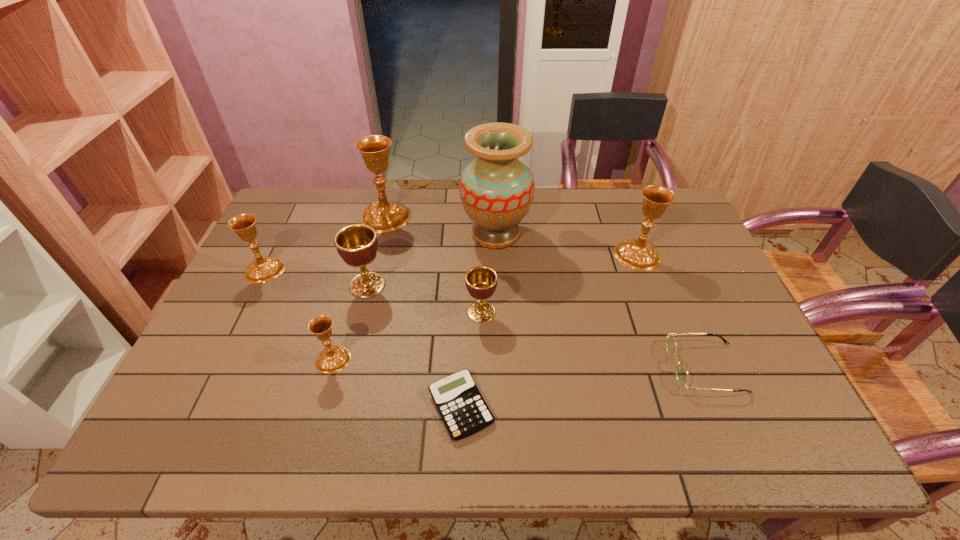
Identify the location of gold chalice that is the fourth closest one to the tallest object. Image resolution: width=960 pixels, height=540 pixels. (262, 269).

The width and height of the screenshot is (960, 540). I want to click on blank area in the image that satisfies the following two spatial constraints: 1. on the front side of the nearest gold chalice; 2. on the left side of the leftmost chalice, so click(x=221, y=359).

Where is `free region that satisfies the following two spatial constraints: 1. on the back side of the calculator; 2. on the left side of the vase`? free region that satisfies the following two spatial constraints: 1. on the back side of the calculator; 2. on the left side of the vase is located at coordinates (467, 234).